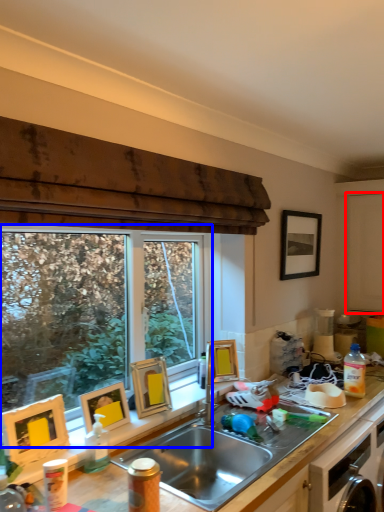
Question: Which object appears farthest to the camera in this image, screen door (highlighted by a red box) or window (highlighted by a blue box)?

Choices:
 (A) screen door
 (B) window

Answer: (A)